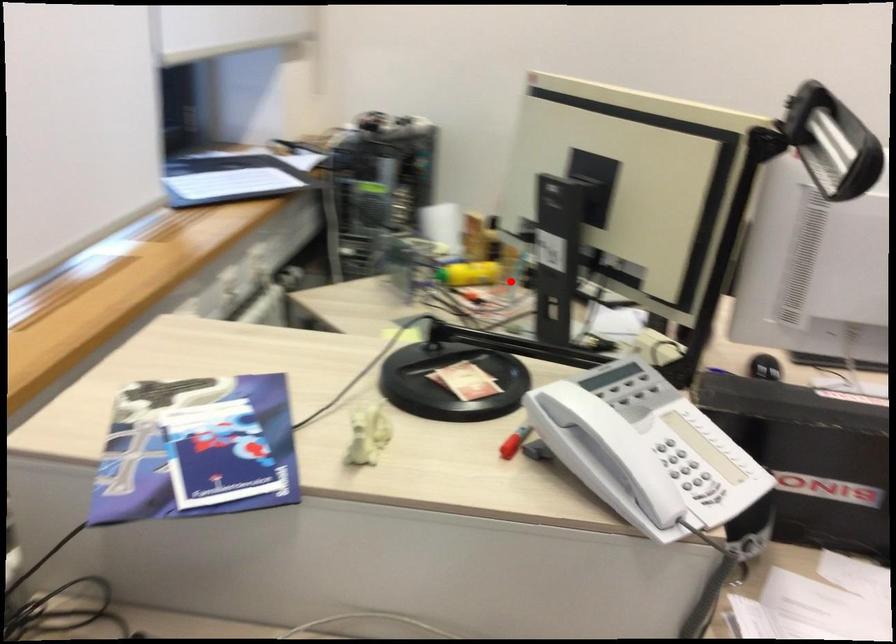
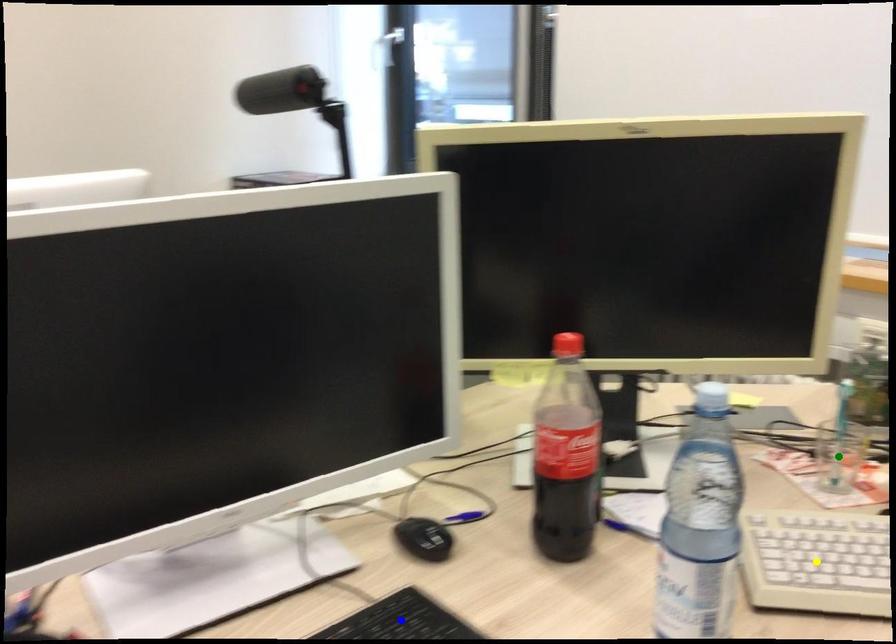
Question: I am providing you with two images of the same scene from different viewpoints. A red point is marked on the first image. You are given multiple points on the second image. Which mark in image 2 goes with the point in image 1?

Choices:
 (A) yellow point
 (B) green point
 (C) blue point

Answer: (B)